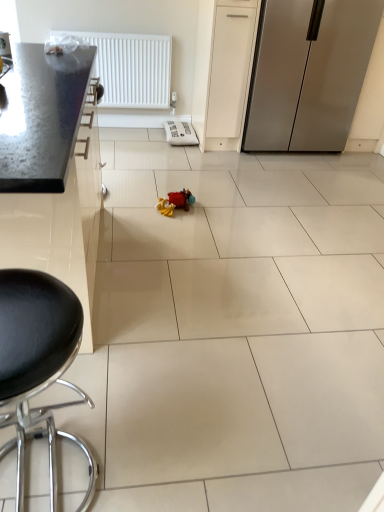
This screenshot has height=512, width=384. Identify the location of white plastic radiator at upper left. (130, 68).

Could satin silver refrigerator at right be considered to be inside black leather stool at lower left?

No, satin silver refrigerator at right is located outside of black leather stool at lower left.

Considering the relative positions of black leather stool at lower left and satin silver refrigerator at right in the image provided, is black leather stool at lower left to the left or to the right of satin silver refrigerator at right?

In the image, black leather stool at lower left appears on the left side of satin silver refrigerator at right.

What's the angular difference between black leather stool at lower left and satin silver refrigerator at right's facing directions?

180 degrees.

At what (x,y) coordinates should I click in order to perform the action: click on refrigerator lying above the black leather stool at lower left (from the image's perspective). Please return your answer as a coordinate pair (x, y). The width and height of the screenshot is (384, 512). Looking at the image, I should click on (308, 74).

Are metallic countertop at left and soft plush toy at center beside each other?

No.

From the image's perspective, which object appears higher, metallic countertop at left or soft plush toy at center?

soft plush toy at center.

From a real-world perspective, is metallic countertop at left physically located above or below soft plush toy at center?

Clearly, from a real-world perspective, metallic countertop at left is above soft plush toy at center.

How many degrees apart are the facing directions of satin silver refrigerator at right and soft plush toy at center?

There is a 92.4-degree angle between the facing directions of satin silver refrigerator at right and soft plush toy at center.

From the image's perspective, is satin silver refrigerator at right located beneath soft plush toy at center?

No, from the image's perspective, satin silver refrigerator at right is not below soft plush toy at center.

Is soft plush toy at center a part of satin silver refrigerator at right?

No.

Is the position of satin silver refrigerator at right more distant than that of soft plush toy at center?

That is True.

Which object is wider, white plastic radiator at upper left or black leather stool at lower left?

With larger width is black leather stool at lower left.

Based on the photo, from a real-world perspective, between white plastic radiator at upper left and black leather stool at lower left, who is vertically higher?

white plastic radiator at upper left is physically above.

From the image's perspective, relative to black leather stool at lower left, is white plastic radiator at upper left above or below?

From the image's perspective, white plastic radiator at upper left appears above black leather stool at lower left.

Based on the photo, is black leather stool at lower left surrounded by white plastic radiator at upper left?

Actually, black leather stool at lower left is outside white plastic radiator at upper left.

Between point (165, 202) and point (256, 87), which one is positioned behind?

The point (256, 87) is more distant.

Locate an element on the screen. The width and height of the screenshot is (384, 512). toy in front of the satin silver refrigerator at right is located at coordinates (175, 202).

Is soft plush toy at center positioned before satin silver refrigerator at right?

That is True.

Does point (344, 141) lie behind point (168, 79)?

No, it is not.

Can we say satin silver refrigerator at right lies outside white plastic radiator at upper left?

Indeed, satin silver refrigerator at right is completely outside white plastic radiator at upper left.

Are satin silver refrigerator at right and white plastic radiator at upper left making contact?

No, satin silver refrigerator at right is not making contact with white plastic radiator at upper left.

Is metallic countertop at left aimed at white plastic radiator at upper left?

No, metallic countertop at left is not turned towards white plastic radiator at upper left.

Is metallic countertop at left with white plastic radiator at upper left?

They are not placed beside each other.

Does point (43, 254) lie behind point (131, 68)?

No, (43, 254) is in front of (131, 68).

The height and width of the screenshot is (512, 384). I want to click on refrigerator on the right of black leather stool at lower left, so point(308,74).

Where is `toy below the metallic countertop at left (from a real-world perspective)`? This screenshot has width=384, height=512. toy below the metallic countertop at left (from a real-world perspective) is located at coordinates (175, 202).

Which object lies further to the anchor point white plastic radiator at upper left, black leather stool at lower left or metallic countertop at left?

black leather stool at lower left is further to white plastic radiator at upper left.

Considering their positions, is white plastic radiator at upper left positioned closer to satin silver refrigerator at right than black leather stool at lower left?

white plastic radiator at upper left.

Considering their positions, is metallic countertop at left positioned further to white plastic radiator at upper left than satin silver refrigerator at right?

The object further to white plastic radiator at upper left is satin silver refrigerator at right.

Which object lies nearer to the anchor point black leather stool at lower left, soft plush toy at center or white plastic radiator at upper left?

Based on the image, soft plush toy at center appears to be nearer to black leather stool at lower left.

Considering their positions, is black leather stool at lower left positioned closer to metallic countertop at left than satin silver refrigerator at right?

Based on the image, black leather stool at lower left appears to be nearer to metallic countertop at left.

Considering their positions, is black leather stool at lower left positioned further to satin silver refrigerator at right than soft plush toy at center?

The object further to satin silver refrigerator at right is black leather stool at lower left.

Based on their spatial positions, is white plastic radiator at upper left or black leather stool at lower left further from metallic countertop at left?

Based on the image, white plastic radiator at upper left appears to be further to metallic countertop at left.

From the image, which object appears to be farther from white plastic radiator at upper left, soft plush toy at center or black leather stool at lower left?

black leather stool at lower left is further to white plastic radiator at upper left.

I want to click on toy between metallic countertop at left and satin silver refrigerator at right along the z-axis, so click(175, 202).

Where is `toy between black leather stool at lower left and white plastic radiator at upper left in the front-back direction`? toy between black leather stool at lower left and white plastic radiator at upper left in the front-back direction is located at coordinates (x=175, y=202).

At what (x,y) coordinates should I click in order to perform the action: click on toy between white plastic radiator at upper left and satin silver refrigerator at right in the horizontal direction. Please return your answer as a coordinate pair (x, y). The height and width of the screenshot is (512, 384). Looking at the image, I should click on (175, 202).

Find the location of a particular element. cabinetry positioned between black leather stool at lower left and white plastic radiator at upper left from near to far is located at coordinates (49, 170).